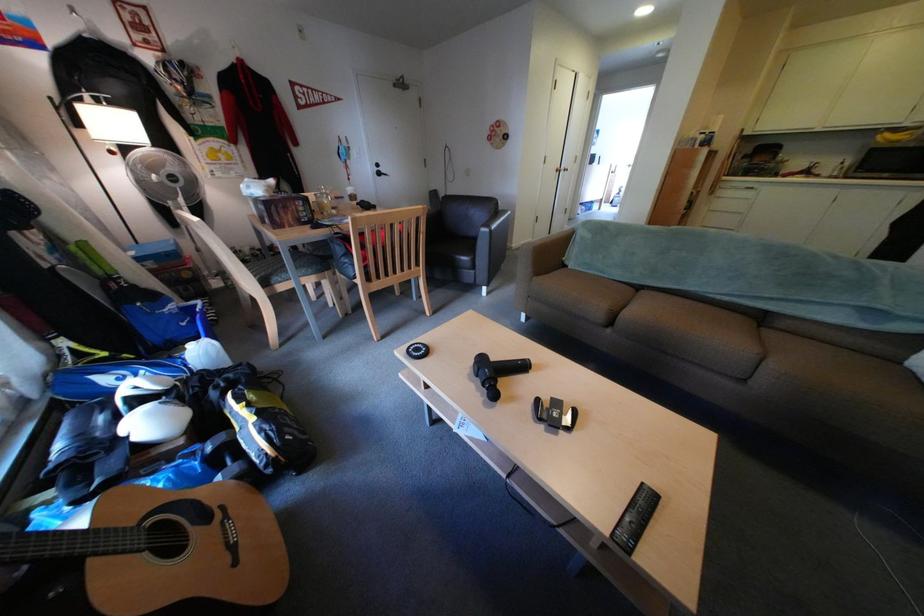
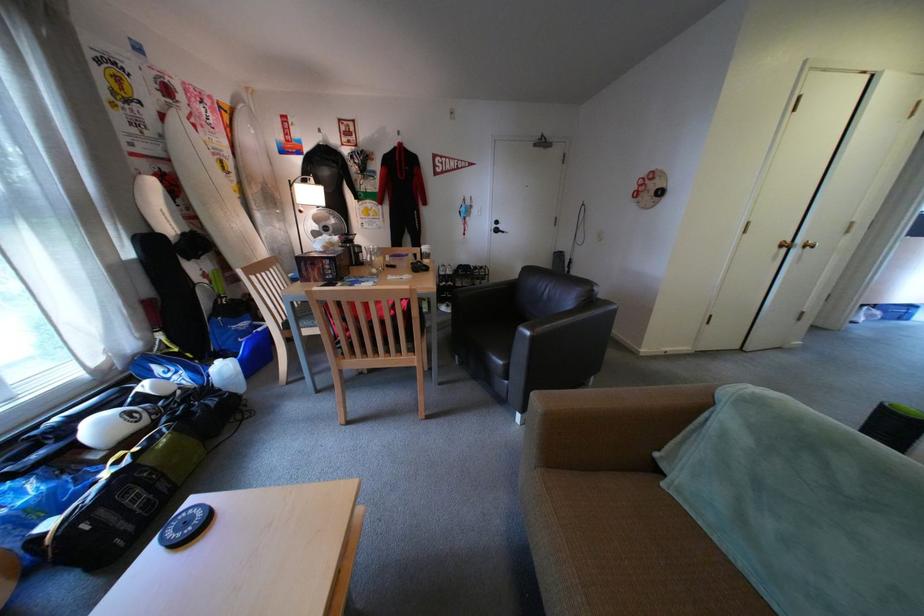
Question: I am providing you with two images of the same scene from different viewpoints. Which of the following objects are not visible in image2?

Choices:
 (A) gold door knob
 (B) chair sitting surface
 (C) black door handle
 (D) none of these

Answer: (D)